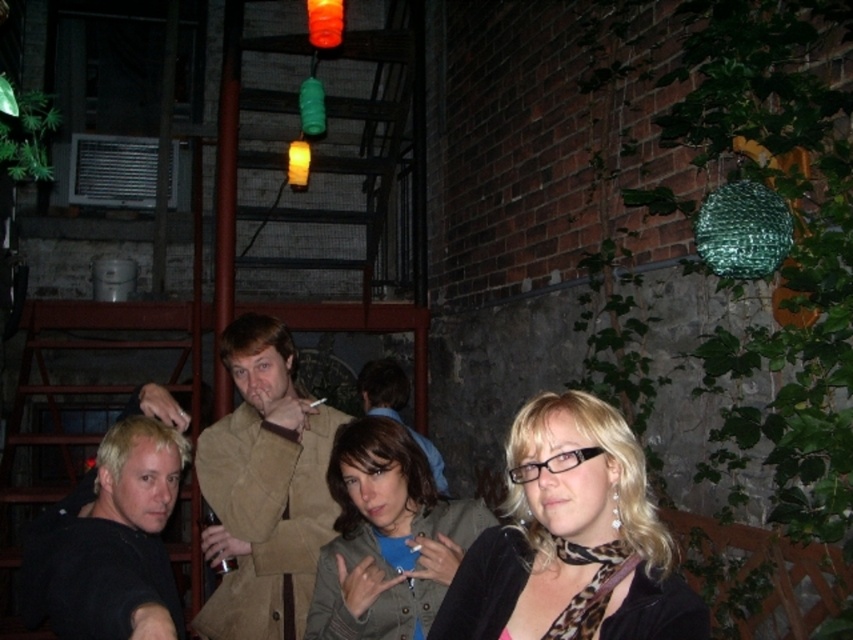
You are standing in front of the group of people in the image. You need to locate the green fabric jacket at center and the light brown leather jacket at center. Which one is positioned to the right of the other?

The green fabric jacket at center is to the right of the light brown leather jacket at center.

You are standing in front of the group and want to hand a gift to the person wearing the tan suede coat at center and the light brown leather jacket at center. Which one can you reach without moving closer?

The tan suede coat at center is closer to the viewer than the light brown leather jacket at center, so you can reach the person wearing the tan suede coat at center without moving closer.